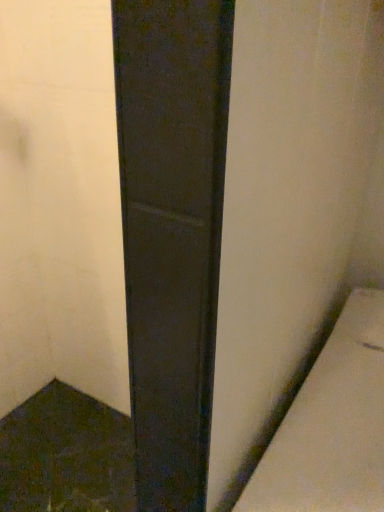
Where is `white fabric bed at lower right`? The height and width of the screenshot is (512, 384). white fabric bed at lower right is located at coordinates tap(331, 425).

What do you see at coordinates (331, 425) in the screenshot?
I see `white fabric bed at lower right` at bounding box center [331, 425].

Find the location of `white fabric bed at lower right`. white fabric bed at lower right is located at coordinates (331, 425).